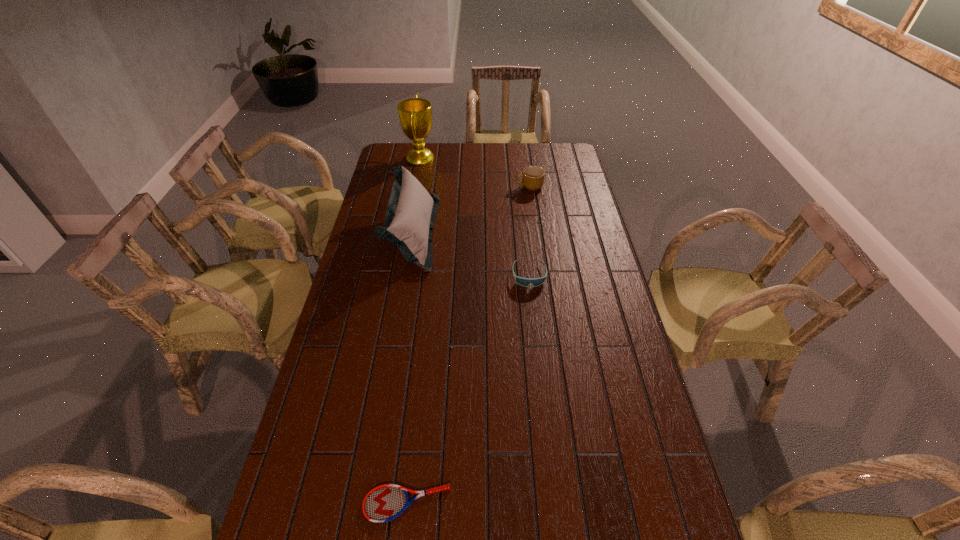
Find the location of a particular element. vacant area situated on the side with the handle of the mug is located at coordinates (469, 186).

Where is `free space located on the side with the handle of the mug`? free space located on the side with the handle of the mug is located at coordinates (488, 186).

Locate an element on the screen. free location located on the side with the handle of the mug is located at coordinates point(492,186).

In order to click on free region located on the front-facing side of the goggles in this screenshot , I will do `click(535, 325)`.

Locate an element on the screen. vacant space situated on the right of the shortest object is located at coordinates (553, 504).

This screenshot has height=540, width=960. Identify the location of object that is at the far edge. (415, 114).

Locate an element on the screen. award that is at the left edge is located at coordinates (415, 114).

This screenshot has width=960, height=540. In order to click on cushion situated at the left edge in this screenshot , I will do `click(411, 211)`.

Find the location of a particular element. This screenshot has width=960, height=540. object that is at the far left corner is located at coordinates (415, 114).

The image size is (960, 540). In the image, there is a desktop. In order to click on vacant area at the far edge in this screenshot , I will do `click(505, 151)`.